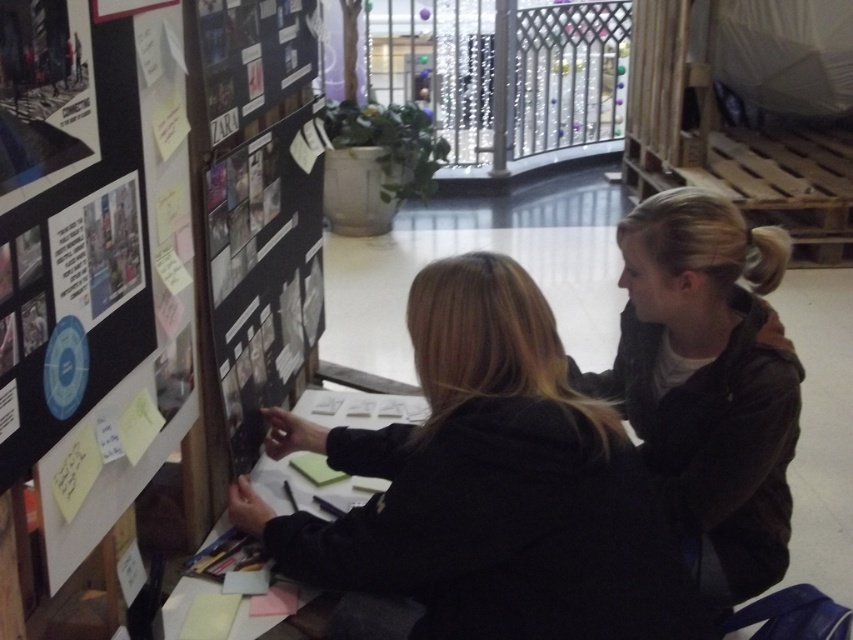
Question: Which object is positioned farthest from the dark brown jacket at upper right?

Choices:
 (A) black matte poster at center
 (B) black matte jacket at center

Answer: (A)

Question: Which point appears farthest from the camera in this image?

Choices:
 (A) (767, 552)
 (B) (489, 358)
 (C) (216, 10)

Answer: (A)

Question: Does black matte poster at center appear on the left side of matte black poster at upper left?

Choices:
 (A) no
 (B) yes

Answer: (A)

Question: Is black matte jacket at center above dark brown jacket at upper right?

Choices:
 (A) no
 (B) yes

Answer: (A)

Question: Which point is farther from the camera taking this photo?

Choices:
 (A) (344, 547)
 (B) (77, 3)
 (C) (306, 80)

Answer: (C)

Question: From the image, what is the correct spatial relationship of dark brown jacket at upper right in relation to black matte poster at center?

Choices:
 (A) right
 (B) left

Answer: (A)